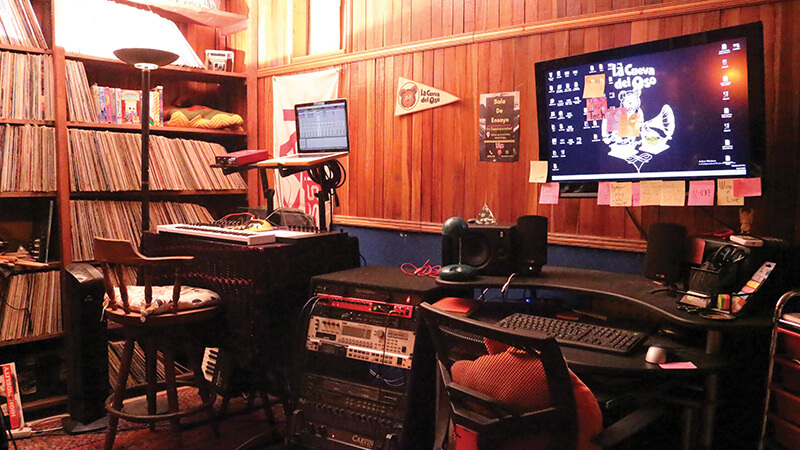
At what (x,y) coordinates should I click in order to perform the action: click on tallest lamp. Please return your answer as a coordinate pair (x, y). Image resolution: width=800 pixels, height=450 pixels. Looking at the image, I should click on (146, 92).